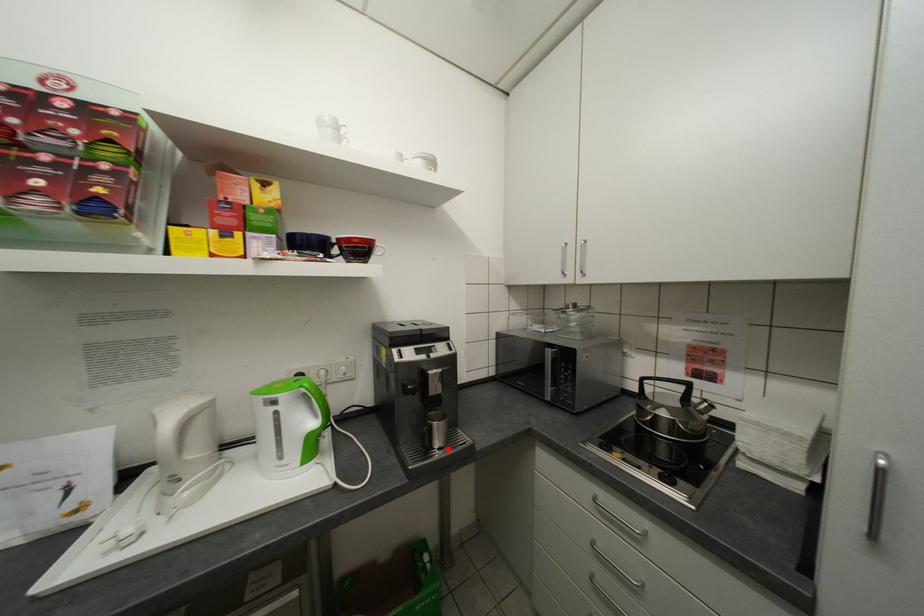
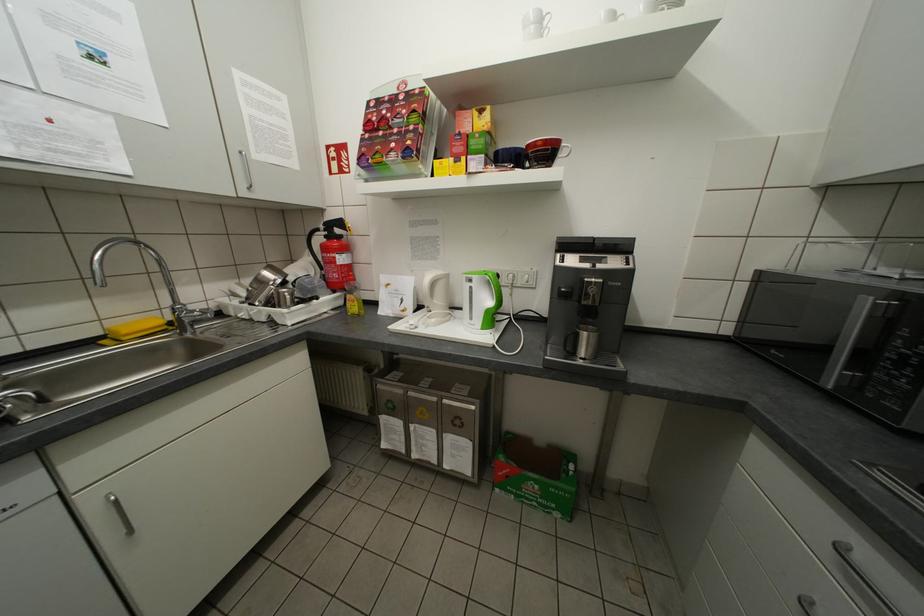
Find the pixel in the second image that matches the highlighted location in the first image.

(590, 359)